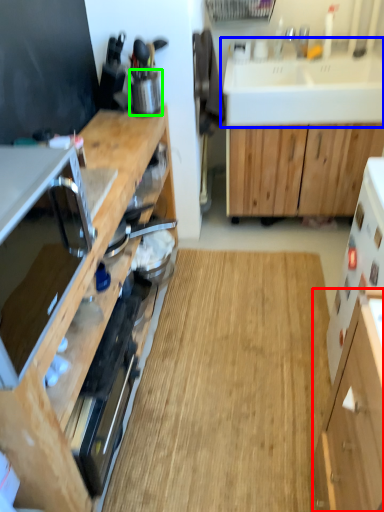
Question: Based on their relative distances, which object is farther from cabinetry (highlighted by a red box)? Choose from sink (highlighted by a blue box) and appliance (highlighted by a green box).

Choices:
 (A) sink
 (B) appliance

Answer: (A)